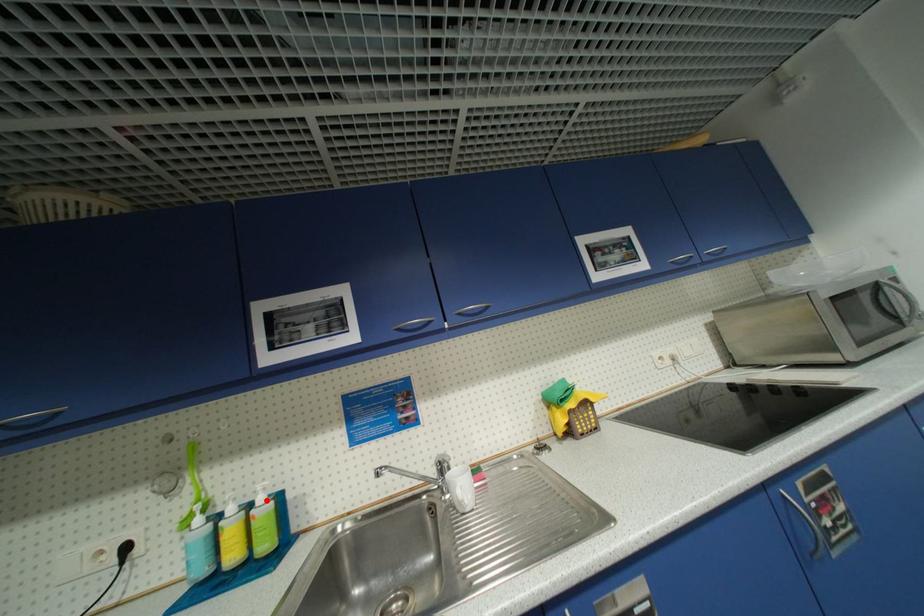
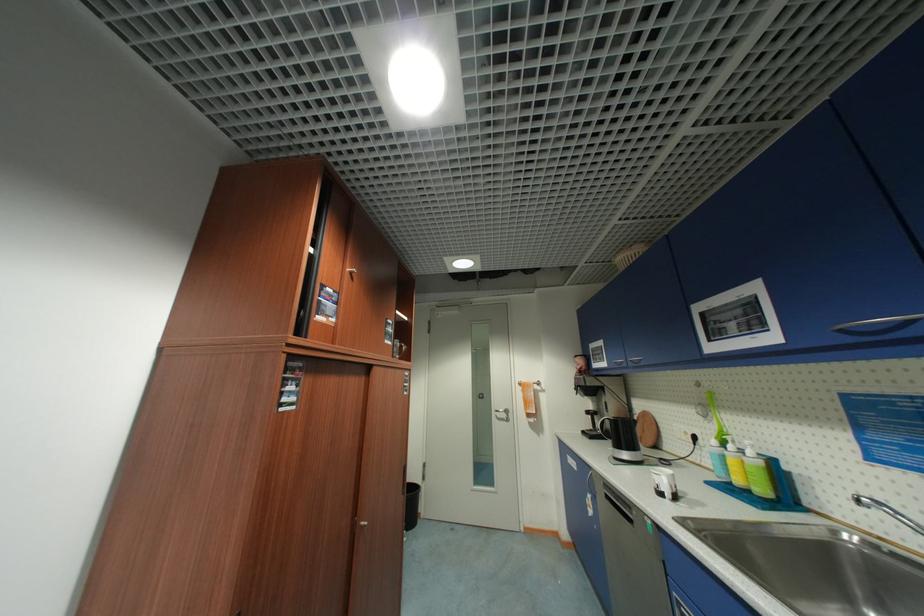
In the second image, find the point that corresponds to the highlighted location in the first image.

(756, 454)